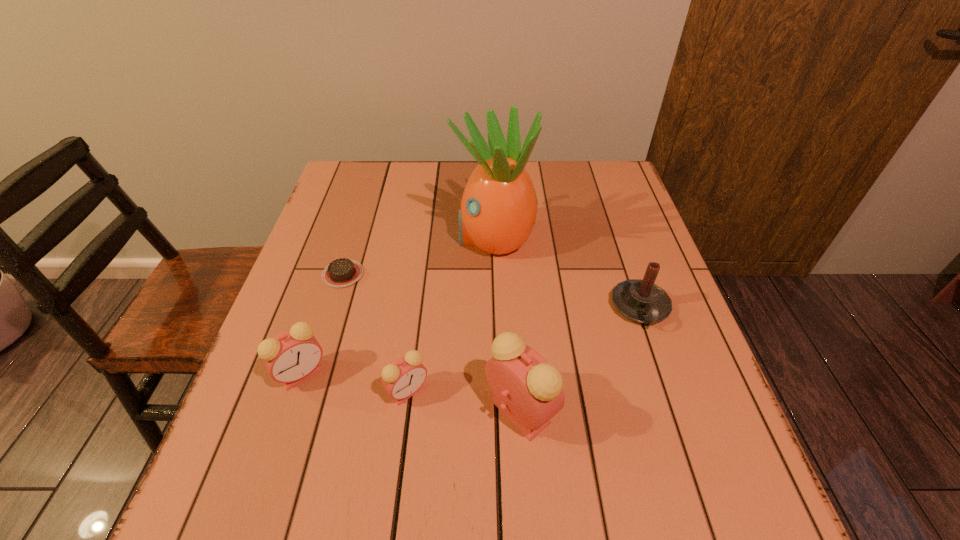
The width and height of the screenshot is (960, 540). I want to click on free space that satisfies the following two spatial constraints: 1. at the entrance of the pineapple; 2. on the face of the second shortest alarm clock, so click(498, 373).

Locate an element on the screen. The height and width of the screenshot is (540, 960). vacant position in the image that satisfies the following two spatial constraints: 1. at the entrance of the pineapple; 2. on the face of the second tallest alarm clock is located at coordinates (498, 373).